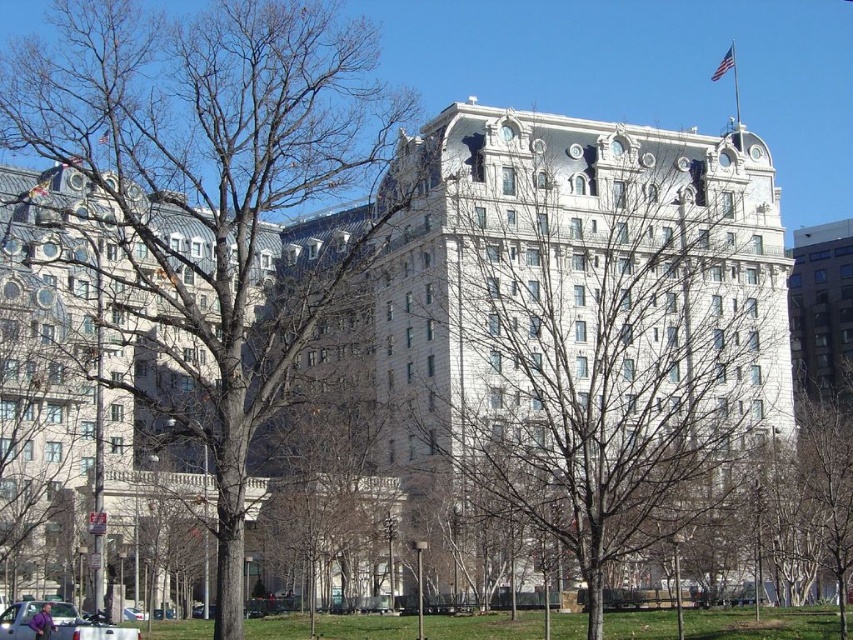
Question: Does bare branches at center appear on the right side of bare wood tree at center?

Choices:
 (A) no
 (B) yes

Answer: (B)

Question: Can you confirm if bare branches at center is positioned to the right of bare wood tree at center?

Choices:
 (A) no
 (B) yes

Answer: (B)

Question: Which point is farther to the camera?

Choices:
 (A) (448, 145)
 (B) (96, 163)

Answer: (A)

Question: Observing the image, what is the correct spatial positioning of bare branches at center in reference to bare wood tree at center?

Choices:
 (A) above
 (B) below

Answer: (B)

Question: Which object is closer to the camera taking this photo?

Choices:
 (A) bare wood tree at center
 (B) bare branches at center

Answer: (B)